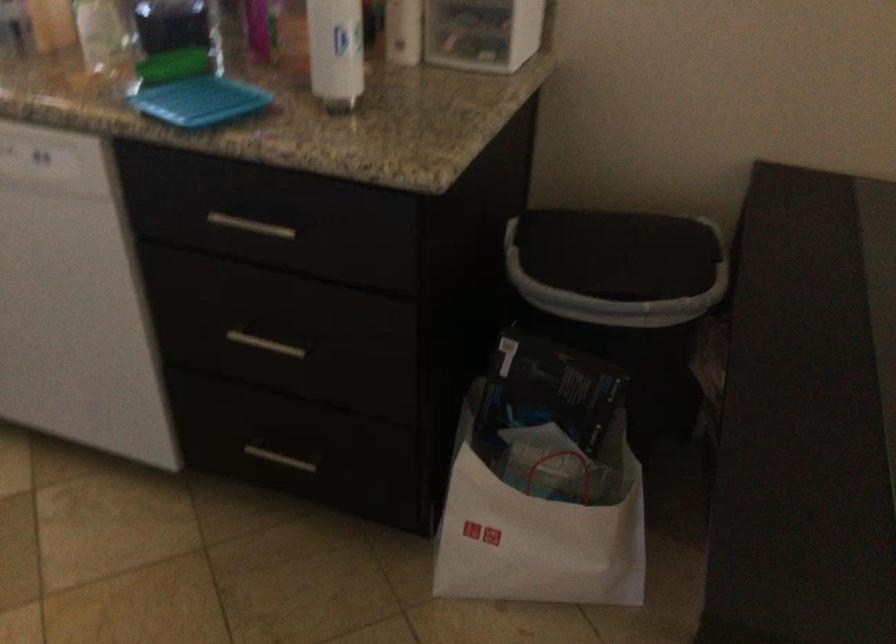
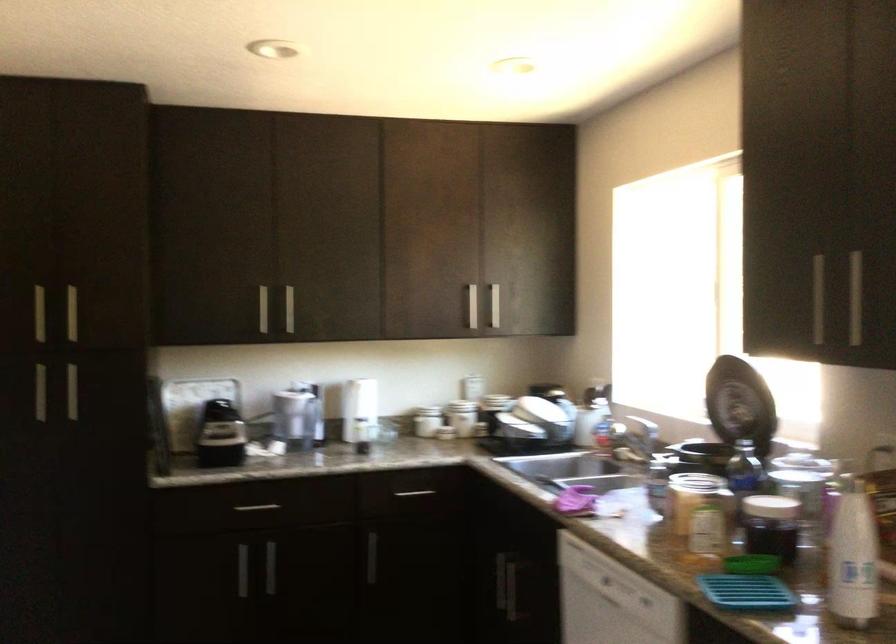
Locate, in the second image, the point that corresponds to pixel 192 105 in the first image.

(745, 592)